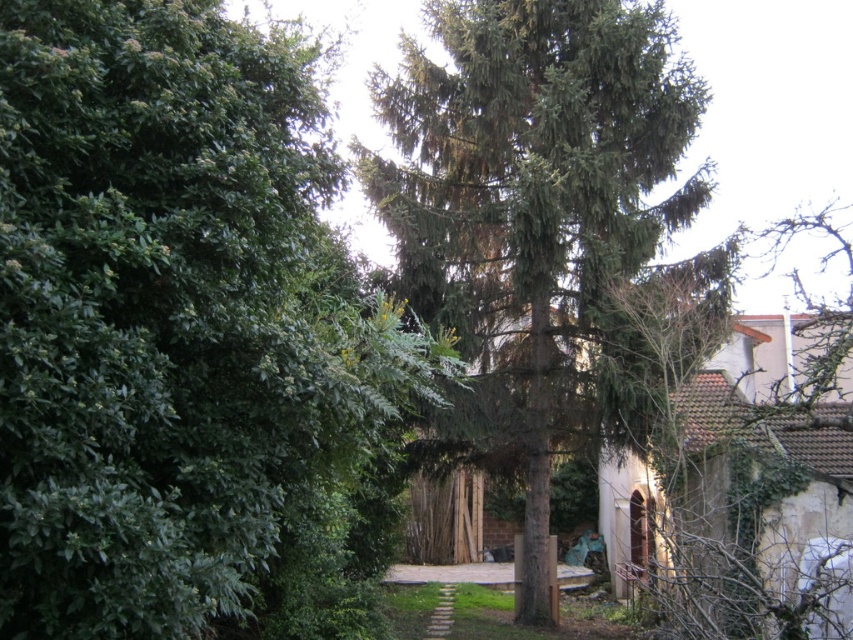
You are standing in the courtyard looking towards the building. There are two trees in your view, the green leafy tree at left and the green textured tree at center. Which tree is closer to you?

The green leafy tree at left is closer to you because it is positioned in front of the green textured tree at center.

You are planning to place a bench between the green leafy tree at left and the green textured tree at center. Considering their widths, which tree would allow more space on its side for people to walk comfortably?

The green textured tree at center has a greater width than the green leafy tree at left, so placing the bench next to the green textured tree at center would provide more space for walking on its side.